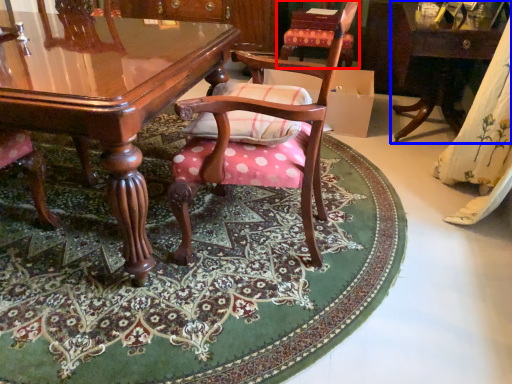
Question: Which object appears closest to the camera in this image, chair (highlighted by a red box) or table (highlighted by a blue box)?

Choices:
 (A) chair
 (B) table

Answer: (B)